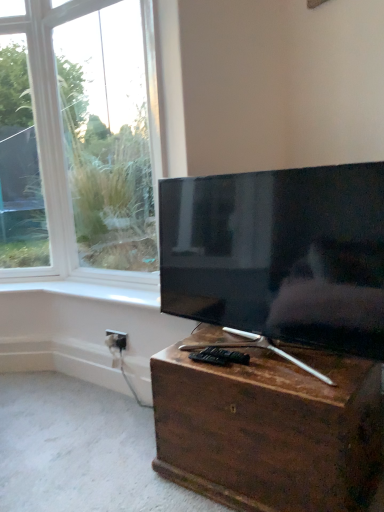
From the picture: What is the approximate width of brown wooden chest at lower center?

The width of brown wooden chest at lower center is 21.63 inches.

The height and width of the screenshot is (512, 384). What do you see at coordinates (270, 430) in the screenshot?
I see `brown wooden chest at lower center` at bounding box center [270, 430].

What do you see at coordinates (88, 291) in the screenshot?
I see `white glossy window sill at upper center` at bounding box center [88, 291].

What do you see at coordinates (116, 340) in the screenshot? Image resolution: width=384 pixels, height=512 pixels. I see `white plastic electric outlet at lower center` at bounding box center [116, 340].

In order to click on matte black tv at center in this screenshot , I will do `click(279, 254)`.

What do you see at coordinates (279, 254) in the screenshot? I see `matte black tv at center` at bounding box center [279, 254].

This screenshot has height=512, width=384. What are the coordinates of `brown wooden chest at lower center` in the screenshot? It's located at (270, 430).

Is point (178, 230) positioned after point (132, 294)?

No, (178, 230) is closer to viewer.

Would you say matte black tv at center is inside or outside white glossy window sill at upper center?

matte black tv at center is not enclosed by white glossy window sill at upper center.

From a real-world perspective, is matte black tv at center physically located above or below white glossy window sill at upper center?

From a real-world perspective, matte black tv at center is physically above white glossy window sill at upper center.

From the image's perspective, is matte black tv at center above or below white glossy window sill at upper center?

From the image's perspective, matte black tv at center appears above white glossy window sill at upper center.

From the image's perspective, who appears lower, white plastic electric outlet at lower center or matte black tv at center?

white plastic electric outlet at lower center appears lower in the image.

Does white plastic electric outlet at lower center lie behind matte black tv at center?

Yes, it is behind matte black tv at center.

Considering the relative sizes of white plastic electric outlet at lower center and matte black tv at center in the image provided, is white plastic electric outlet at lower center smaller than matte black tv at center?

Yes, white plastic electric outlet at lower center is smaller than matte black tv at center.

From a real-world perspective, between white plastic electric outlet at lower center and matte black tv at center, who is vertically higher?

From a 3D spatial view, matte black tv at center is above.

Is white glossy window sill at upper center located within white plastic electric outlet at lower center?

No, white glossy window sill at upper center is not a part of white plastic electric outlet at lower center.

Considering the positions of point (113, 334) and point (64, 281), is point (113, 334) closer or farther from the camera than point (64, 281)?

Clearly, point (113, 334) is closer to the camera than point (64, 281).

From the image's perspective, between white plastic electric outlet at lower center and white glossy window sill at upper center, which one is located above?

white glossy window sill at upper center is shown above in the image.

Does white plastic electric outlet at lower center touch white glossy window sill at upper center?

No, white plastic electric outlet at lower center is not next to white glossy window sill at upper center.

Would you say white glossy window sill at upper center is to the left or to the right of white plastic electric outlet at lower center in the picture?

In the image, white glossy window sill at upper center appears on the left side of white plastic electric outlet at lower center.

Could you tell me if white glossy window sill at upper center is facing white plastic electric outlet at lower center?

No, white glossy window sill at upper center is not oriented towards white plastic electric outlet at lower center.

Can you confirm if white glossy window sill at upper center is taller than white plastic electric outlet at lower center?

In fact, white glossy window sill at upper center may be shorter than white plastic electric outlet at lower center.

From the image's perspective, relative to white plastic electric outlet at lower center, is white glossy window sill at upper center above or below?

white glossy window sill at upper center is situated higher than white plastic electric outlet at lower center in the image.

Does point (33, 279) come behind point (248, 215)?

Yes, it is.

In terms of height, does white glossy window sill at upper center look taller or shorter compared to matte black tv at center?

Clearly, white glossy window sill at upper center is shorter compared to matte black tv at center.

Is white glossy window sill at upper center turned away from matte black tv at center?

No, white glossy window sill at upper center is not facing the opposite direction of matte black tv at center.

From the image's perspective, is white glossy window sill at upper center located above or below matte black tv at center?

Clearly, from the image's perspective, white glossy window sill at upper center is below matte black tv at center.

Can you confirm if white plastic electric outlet at lower center is thinner than brown wooden chest at lower center?

Correct, the width of white plastic electric outlet at lower center is less than that of brown wooden chest at lower center.

At what (x,y) coordinates should I click in order to perform the action: click on electric outlet above the brown wooden chest at lower center (from the image's perspective). Please return your answer as a coordinate pair (x, y). Looking at the image, I should click on (116, 340).

Is white plastic electric outlet at lower center smaller than brown wooden chest at lower center?

Correct, white plastic electric outlet at lower center occupies less space than brown wooden chest at lower center.

Is white plastic electric outlet at lower center looking in the opposite direction of brown wooden chest at lower center?

No, brown wooden chest at lower center is not at the back of white plastic electric outlet at lower center.

From the image's perspective, which object appears higher, matte black tv at center or white plastic electric outlet at lower center?

matte black tv at center appears higher in the image.

Is matte black tv at center positioned far away from white plastic electric outlet at lower center?

No, there isn't a large distance between matte black tv at center and white plastic electric outlet at lower center.

Looking at their sizes, would you say matte black tv at center is wider or thinner than white plastic electric outlet at lower center?

matte black tv at center is wider than white plastic electric outlet at lower center.

Find the location of a particular element. window sill below the matte black tv at center (from a real-world perspective) is located at coordinates (88, 291).

The image size is (384, 512). I want to click on television that appears above the white plastic electric outlet at lower center (from a real-world perspective), so click(279, 254).

Looking at the image, which one is located closer to white glossy window sill at upper center, matte black tv at center or brown wooden chest at lower center?

matte black tv at center is positioned closer to the anchor white glossy window sill at upper center.

Looking at the image, which one is located further to white glossy window sill at upper center, brown wooden chest at lower center or white plastic electric outlet at lower center?

brown wooden chest at lower center is further to white glossy window sill at upper center.

Looking at the image, which one is located closer to brown wooden chest at lower center, matte black tv at center or white glossy window sill at upper center?

matte black tv at center is closer to brown wooden chest at lower center.

Which object lies further to the anchor point matte black tv at center, white glossy window sill at upper center or brown wooden chest at lower center?

The object further to matte black tv at center is white glossy window sill at upper center.

Looking at the image, which one is located further to matte black tv at center, white plastic electric outlet at lower center or white glossy window sill at upper center?

white plastic electric outlet at lower center is positioned further to the anchor matte black tv at center.

Looking at the image, which one is located further to matte black tv at center, brown wooden chest at lower center or white plastic electric outlet at lower center?

white plastic electric outlet at lower center is positioned further to the anchor matte black tv at center.

Based on their spatial positions, is matte black tv at center or white plastic electric outlet at lower center further from brown wooden chest at lower center?

Among the two, white plastic electric outlet at lower center is located further to brown wooden chest at lower center.

Considering their positions, is brown wooden chest at lower center positioned closer to white plastic electric outlet at lower center than white glossy window sill at upper center?

Among the two, white glossy window sill at upper center is located nearer to white plastic electric outlet at lower center.

Image resolution: width=384 pixels, height=512 pixels. Identify the location of nightstand between matte black tv at center and white glossy window sill at upper center in the front-back direction. (270, 430).

The image size is (384, 512). I want to click on window sill between brown wooden chest at lower center and white plastic electric outlet at lower center in the front-back direction, so click(88, 291).

What are the coordinates of `nightstand between matte black tv at center and white plastic electric outlet at lower center from front to back` in the screenshot? It's located at click(x=270, y=430).

Locate an element on the screen. This screenshot has height=512, width=384. window sill located between matte black tv at center and white plastic electric outlet at lower center in the depth direction is located at coordinates (88, 291).